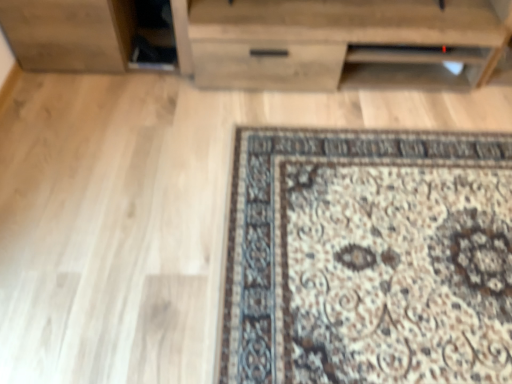
Image resolution: width=512 pixels, height=384 pixels. Find the location of `wooden chest of drawers at upper center`. wooden chest of drawers at upper center is located at coordinates (337, 42).

What do you see at coordinates (337, 42) in the screenshot? Image resolution: width=512 pixels, height=384 pixels. I see `wooden chest of drawers at upper center` at bounding box center [337, 42].

Locate an element on the screen. The image size is (512, 384). wooden chest of drawers at upper center is located at coordinates (337, 42).